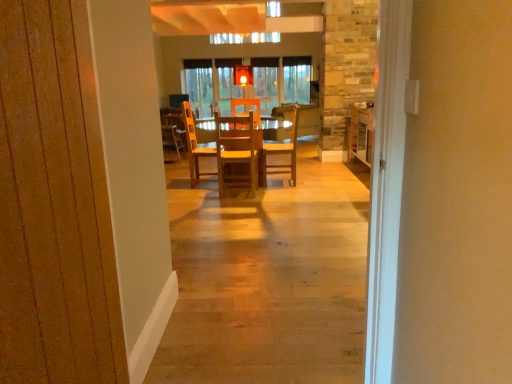
Question: Relative to wooden chair at center, arranged as the 1th chair when viewed from the back, is wooden at center, placed as the 3th chair when sorted from left to right, in front or behind?

Choices:
 (A) behind
 (B) front

Answer: (B)

Question: Is point (189, 145) closer or farther from the camera than point (166, 145)?

Choices:
 (A) closer
 (B) farther

Answer: (B)

Question: Considering the real-world distances, which object is farthest from the wooden chair at center, which is the third chair in right-to-left order?

Choices:
 (A) wooden at center, placed as the 3th chair when sorted from left to right
 (B) wooden chair at center, which is counted as the 4th chair, starting from the front
 (C) wooden chair at center, which is counted as the third chair, starting from the front

Answer: (B)

Question: Based on their relative distances, which object is nearer to the wooden chair at center, arranged as the 1th chair when viewed from the back?

Choices:
 (A) wooden at center, the second chair when ordered from right to left
 (B) wooden chair at center, arranged as the 1th chair when viewed from the right
 (C) wooden chair at center, the first chair positioned from the front

Answer: (A)